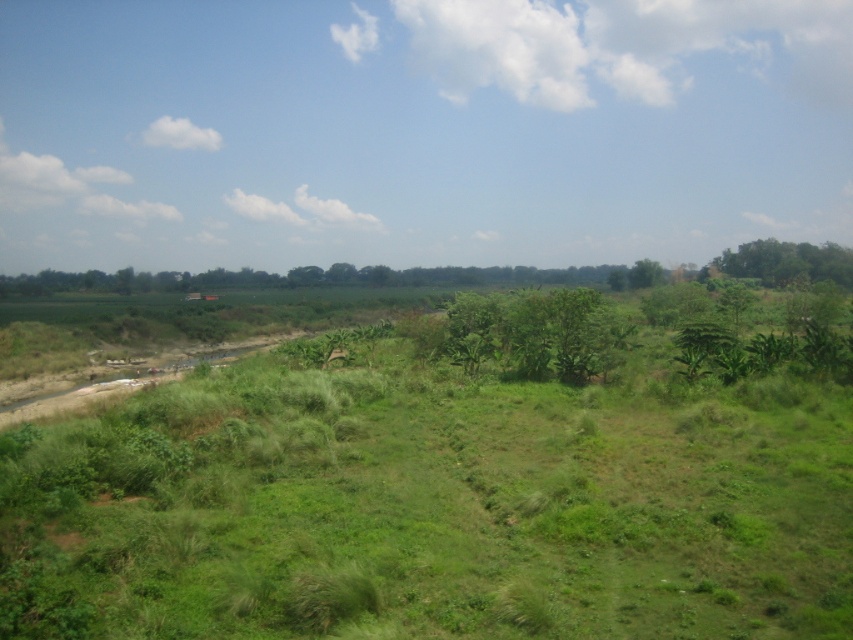
You are standing at the origin point of the coordinate system. You want to reach the green leafy tree at center. Which direction should you move in terms of x and y coordinates?

The green leafy tree at center is located at point 0.523 in the x direction and 0.632 in the y direction. So you should move in the positive x and positive y direction to reach it.

You are a hiker who wants to take a photo of both the green leafy tree at center and the green leafy tree at upper right. Which tree should you stand closer to in order to capture both in the same frame?

You should stand closer to the green leafy tree at center because it is positioned below the green leafy tree at upper right, so moving closer to the lower one will help frame both in the photo.

You are a hiker standing in the middle of the rural landscape. You see the green leafy tree at center and the green leafy tree at upper right. Which tree is closer to you?

The green leafy tree at center is closer to you because it is in front of the green leafy tree at upper right.